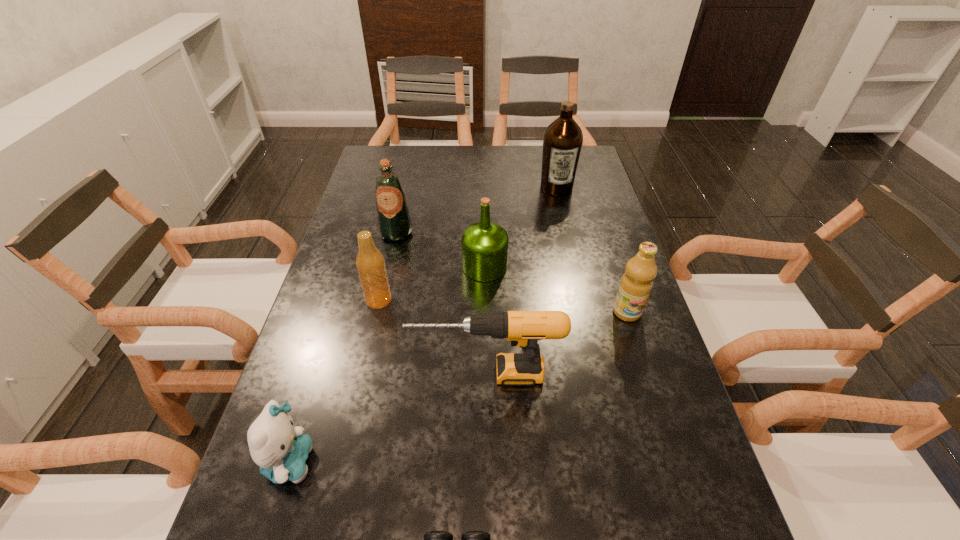
This screenshot has width=960, height=540. Find the location of `the seventh tallest object`. the seventh tallest object is located at coordinates (280, 450).

The image size is (960, 540). What are the coordinates of `kitten` in the screenshot? It's located at (280, 450).

This screenshot has height=540, width=960. In order to click on vacant position located on the label of the third olive oil from left to right in this screenshot , I will do `click(570, 249)`.

The width and height of the screenshot is (960, 540). What are the coordinates of `vacant space positioned on the front-facing side of the leftmost olive oil` in the screenshot? It's located at (374, 333).

Find the location of `vacant area situated 0.380m on the front of the second olive oil from left to right`. vacant area situated 0.380m on the front of the second olive oil from left to right is located at coordinates (487, 416).

Find the location of a particular element. vacant space located 0.230m on the front of the beer bottle is located at coordinates (358, 392).

Where is `vacant region located on the label of the nearest olive oil`? vacant region located on the label of the nearest olive oil is located at coordinates (646, 373).

This screenshot has height=540, width=960. Identify the location of free spot located 0.260m on the handle side of the drill. (291, 373).

Locate an element on the screen. vacant region located on the handle side of the drill is located at coordinates (342, 373).

Image resolution: width=960 pixels, height=540 pixels. Find the location of `vacant space located on the handle side of the drill`. vacant space located on the handle side of the drill is located at coordinates (356, 373).